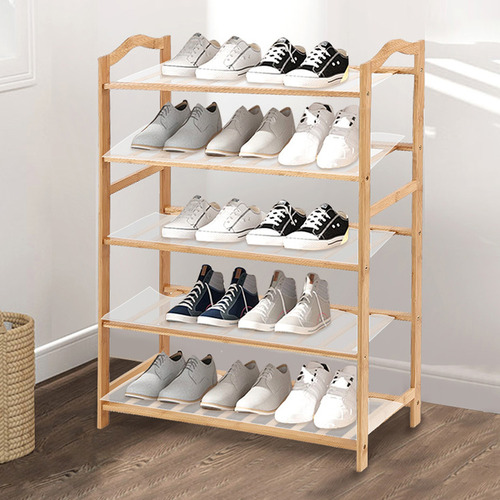
In order to click on shoes on second shelf fromtop in this screenshot , I will do point(335,151), point(315,153), point(269,146), point(227,141), point(198,131), point(163,121).